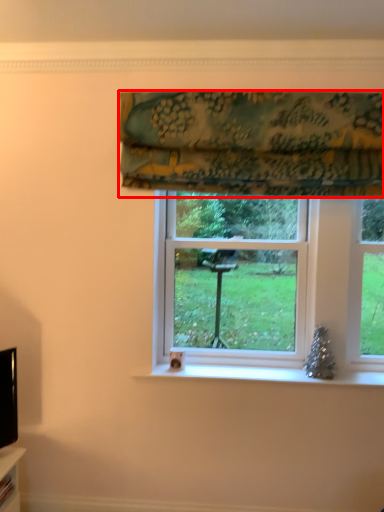
Question: Considering the relative positions of curtain (annotated by the red box) and bay window in the image provided, where is curtain (annotated by the red box) located with respect to the staircase?

Choices:
 (A) left
 (B) right

Answer: (A)